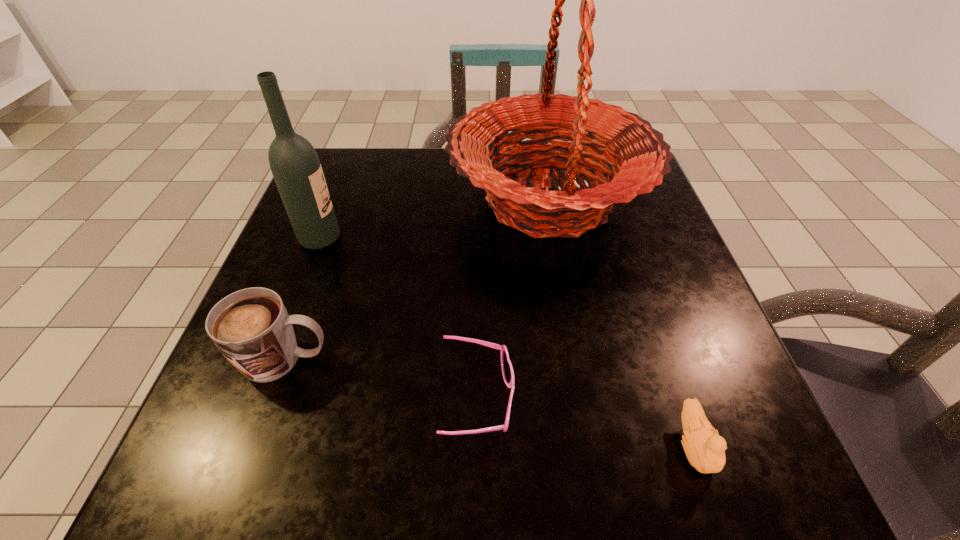
The width and height of the screenshot is (960, 540). What are the coordinates of `the tallest object` in the screenshot? It's located at (642, 159).

The width and height of the screenshot is (960, 540). Find the location of `wine bottle`. wine bottle is located at coordinates (295, 166).

Locate an element on the screen. The width and height of the screenshot is (960, 540). the third tallest object is located at coordinates (251, 327).

Image resolution: width=960 pixels, height=540 pixels. Find the location of `the second shortest object`. the second shortest object is located at coordinates click(x=705, y=450).

Locate an element on the screen. The width and height of the screenshot is (960, 540). the shortest object is located at coordinates (507, 370).

Locate an element on the screen. This screenshot has width=960, height=540. free space located 0.250m on the left of the basket is located at coordinates (337, 200).

Locate an element on the screen. vacant area situated 0.060m on the labeled side of the second tallest object is located at coordinates (371, 239).

Image resolution: width=960 pixels, height=540 pixels. What are the coordinates of `free location located 0.210m on the side of the third shortest object with the handle` in the screenshot? It's located at (465, 359).

At what (x,y) coordinates should I click in order to perform the action: click on vacant space located 0.120m on the front-facing side of the shortest object. Please return your answer as a coordinate pair (x, y). The image size is (960, 540). Looking at the image, I should click on (594, 399).

Locate an element on the screen. The height and width of the screenshot is (540, 960). object that is positioned at the far edge is located at coordinates (642, 159).